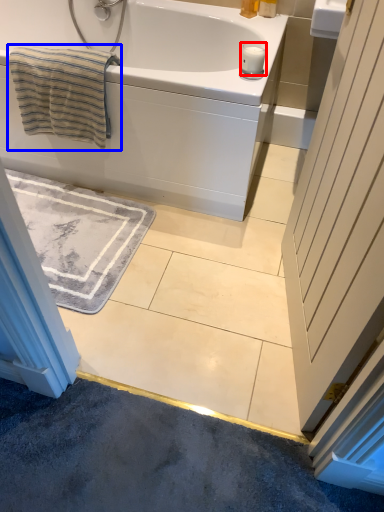
Question: Which object appears farthest to the camera in this image, candle (highlighted by a red box) or beach towel (highlighted by a blue box)?

Choices:
 (A) candle
 (B) beach towel

Answer: (A)